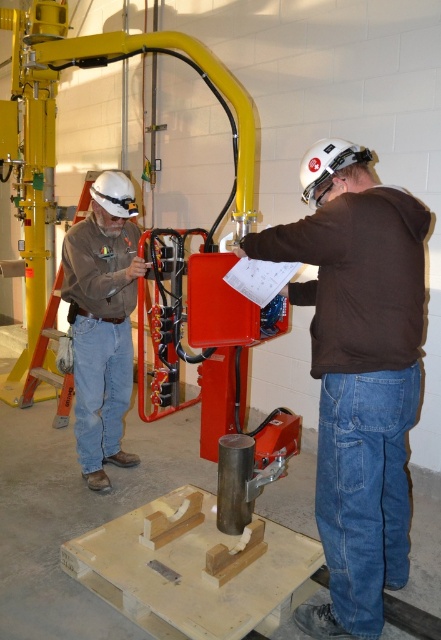
Question: Can you confirm if white matte helmet at upper center is positioned to the right of white matte helmet at upper left?

Choices:
 (A) no
 (B) yes

Answer: (B)

Question: Which point is closer to the camera?

Choices:
 (A) (130, 193)
 (B) (100, 381)
 (C) (336, 168)

Answer: (C)

Question: Does blue denim jeans at left have a smaller size compared to white matte helmet at upper left?

Choices:
 (A) no
 (B) yes

Answer: (A)

Question: Which point is closer to the camera?

Choices:
 (A) white matte helmet at upper center
 (B) blue denim jeans at left

Answer: (A)

Question: Can you confirm if brown matte jacket at center is smaller than white matte helmet at upper left?

Choices:
 (A) no
 (B) yes

Answer: (A)

Question: Based on their relative distances, which object is nearer to the brown matte jacket at center?

Choices:
 (A) denim at center
 (B) white matte helmet at upper left
 (C) matte brown shirt at left
 (D) white matte helmet at upper center

Answer: (A)